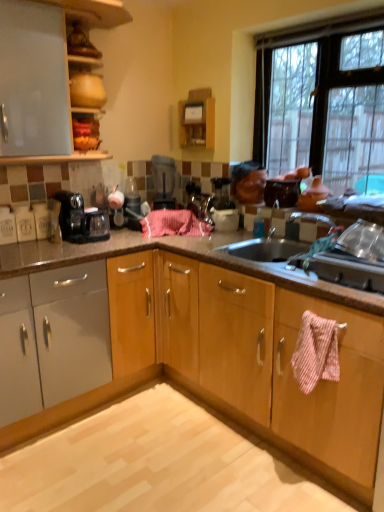
In order to face black plastic coffee maker at left, should I rotate leftwards or rightwards?

To align with it, rotate left about 14.159°.

Describe the element at coordinates (323, 99) in the screenshot. I see `clear glass window at upper right` at that location.

Measure the distance between point (158, 156) and camera.

Point (158, 156) and camera are 2.99 meters apart from each other.

At what (x,y) coordinates should I click in order to perform the action: click on metallic silver sink at right. Please return your answer as a coordinate pair (x, y). This screenshot has height=512, width=384. Looking at the image, I should click on (363, 241).

At what (x,y) coordinates should I click in order to perform the action: click on black plastic coffee maker at left. Please return your answer as a coordinate pair (x, y). The width and height of the screenshot is (384, 512). Looking at the image, I should click on (81, 219).

From a real-world perspective, relative to matte white cabinet at upper left, is clear glass window at upper right vertically above or below?

From a real-world perspective, clear glass window at upper right is physically below matte white cabinet at upper left.

Considering the relative sizes of clear glass window at upper right and matte white cabinet at upper left in the image provided, is clear glass window at upper right thinner than matte white cabinet at upper left?

Yes.

How different are the orientations of clear glass window at upper right and matte white cabinet at upper left in degrees?

They differ by 90.5 degrees in their facing directions.

From the image's perspective, which is below, clear glass window at upper right or matte white cabinet at upper left?

clear glass window at upper right is shown below in the image.

Based on their positions, is black plastic coffee maker at left located to the left or right of metallic silver sink at right?

In the image, black plastic coffee maker at left appears on the left side of metallic silver sink at right.

From the image's perspective, relative to metallic silver sink at right, is black plastic coffee maker at left above or below?

black plastic coffee maker at left is situated higher than metallic silver sink at right in the image.

Is black plastic coffee maker at left smaller than metallic silver sink at right?

Actually, black plastic coffee maker at left might be larger than metallic silver sink at right.

Is pink striped towel at lower right, marked as the second blanket in a back-to-front arrangement, inside black plastic blender at center?

No, pink striped towel at lower right, marked as the second blanket in a back-to-front arrangement, is located outside of black plastic blender at center.

Is black plastic blender at center positioned behind pink striped towel at lower right, placed as the second blanket when sorted from left to right?

Yes, the depth of black plastic blender at center is greater than that of pink striped towel at lower right, placed as the second blanket when sorted from left to right.

In order to click on kitchen appliance above the pink striped towel at lower right, placed as the second blanket when sorted from left to right (from the image's perspective) in this screenshot , I will do `click(163, 181)`.

Which of these two, black plastic blender at center or pink striped towel at lower right, acting as the 1th blanket starting from the right, is thinner?

Thinner between the two is pink striped towel at lower right, acting as the 1th blanket starting from the right.

Are clear glass window at upper right and pink woven towel at center, which is the 1th blanket in left-to-right order, far apart?

Actually, clear glass window at upper right and pink woven towel at center, which is the 1th blanket in left-to-right order, are a little close together.

Could pink woven towel at center, the 1th blanket when ordered from back to front, be considered to be inside clear glass window at upper right?

That's incorrect, pink woven towel at center, the 1th blanket when ordered from back to front, is not inside clear glass window at upper right.

Between clear glass window at upper right and pink woven towel at center, which is the 2th blanket in right-to-left order, which one appears on the left side from the viewer's perspective?

Positioned to the left is pink woven towel at center, which is the 2th blanket in right-to-left order.

Is point (334, 82) closer or farther from the camera than point (155, 231)?

Point (334, 82) appears to be closer to the viewer than point (155, 231).

Find the location of a particular element. home appliance below the matte white cabinet at upper left (from a real-world perspective) is located at coordinates (81, 219).

Which object is further away from the camera, black plastic coffee maker at left or matte white cabinet at upper left?

black plastic coffee maker at left is behind.

Is point (96, 232) closer or farther from the camera than point (66, 124)?

Point (96, 232) is farther from the camera than point (66, 124).

Can you tell me how much black plastic coffee maker at left and matte white cabinet at upper left differ in facing direction?

0.7 degrees separate the facing orientations of black plastic coffee maker at left and matte white cabinet at upper left.

Is the position of pink woven towel at center, the 1th blanket when ordered from back to front, less distant than that of matte white cabinet at upper left?

No, it is not.

Which of these two, pink woven towel at center, which is the 1th blanket in left-to-right order, or matte white cabinet at upper left, is thinner?

pink woven towel at center, which is the 1th blanket in left-to-right order, is thinner.

Identify the location of cabinetry in front of the pink woven towel at center, which ranks as the second blanket in bottom-to-top order. (50, 75).

Could you tell me if pink woven towel at center, the 1th blanket when ordered from back to front, is turned towards matte white cabinet at upper left?

No, pink woven towel at center, the 1th blanket when ordered from back to front, is not oriented towards matte white cabinet at upper left.

From the image's perspective, which object appears higher, clear glass window at upper right or black plastic coffee maker at left?

clear glass window at upper right.

Is there a large distance between clear glass window at upper right and black plastic coffee maker at left?

Yes, clear glass window at upper right and black plastic coffee maker at left are quite far apart.

At what (x,y) coordinates should I click in order to perform the action: click on home appliance lying behind the clear glass window at upper right. Please return your answer as a coordinate pair (x, y). Image resolution: width=384 pixels, height=512 pixels. Looking at the image, I should click on (81, 219).

Which object is more forward, clear glass window at upper right or black plastic coffee maker at left?

clear glass window at upper right is more forward.

Identify the location of window below the matte white cabinet at upper left (from a real-world perspective). (323, 99).

Image resolution: width=384 pixels, height=512 pixels. Identify the location of home appliance behind the metallic silver sink at right. 81,219.

When comparing their distances from light brown polished granite at lower center, does pink woven towel at center, which ranks as the second blanket in bottom-to-top order, or pink striped towel at lower right, the first blanket in the front-to-back sequence, seem closer?

The object closer to light brown polished granite at lower center is pink striped towel at lower right, the first blanket in the front-to-back sequence.

Which object lies nearer to the anchor point black plastic blender at center, matte white cabinet at upper left or pink striped towel at lower right, which appears as the first blanket when ordered from the bottom?

Based on the image, matte white cabinet at upper left appears to be nearer to black plastic blender at center.

Based on the photo, when comparing their distances from pink woven towel at center, which is the 2th blanket in right-to-left order, does pink striped towel at lower right, the first blanket in the front-to-back sequence, or black plastic blender at center seem further?

pink striped towel at lower right, the first blanket in the front-to-back sequence.

Which object lies nearer to the anchor point black plastic coffee maker at left, light brown polished granite at lower center or black plastic blender at center?

Based on the image, black plastic blender at center appears to be nearer to black plastic coffee maker at left.

Consider the image. Based on their spatial positions, is black plastic coffee maker at left or black plastic blender at center closer to pink striped towel at lower right, acting as the 1th blanket starting from the right?

The object closer to pink striped towel at lower right, acting as the 1th blanket starting from the right, is black plastic coffee maker at left.

Looking at this image, from the image, which object appears to be nearer to black plastic blender at center, matte white cabinet at upper left or clear glass window at upper right?

Among the two, clear glass window at upper right is located nearer to black plastic blender at center.

Based on their spatial positions, is matte white cabinet at upper left or black plastic coffee maker at left further from pink striped towel at lower right, placed as the second blanket when sorted from left to right?

The object further to pink striped towel at lower right, placed as the second blanket when sorted from left to right, is matte white cabinet at upper left.

When comparing their distances from black plastic blender at center, does metallic silver sink at right or clear glass window at upper right seem closer?

Among the two, clear glass window at upper right is located nearer to black plastic blender at center.

You are a GUI agent. You are given a task and a screenshot of the screen. Output one action in this format:
    pyautogui.click(x=<x>, y=<y>)
    Task: Click on the kitchen appliance that lies between clear glass window at upper right and light brown polished granite at lower center from top to bottom
    The image size is (384, 512).
    Given the screenshot: What is the action you would take?
    pyautogui.click(x=163, y=181)

Where is `kitchen appliance between matte white cabinet at upper left and light brown polished granite at lower center from top to bottom`? kitchen appliance between matte white cabinet at upper left and light brown polished granite at lower center from top to bottom is located at coordinates (163, 181).

Where is `kitchen appliance between matte white cabinet at upper left and clear glass window at upper right in the horizontal direction`? The image size is (384, 512). kitchen appliance between matte white cabinet at upper left and clear glass window at upper right in the horizontal direction is located at coordinates (163, 181).

The height and width of the screenshot is (512, 384). In order to click on home appliance located between light brown polished granite at lower center and black plastic blender at center in the depth direction in this screenshot , I will do `click(81, 219)`.